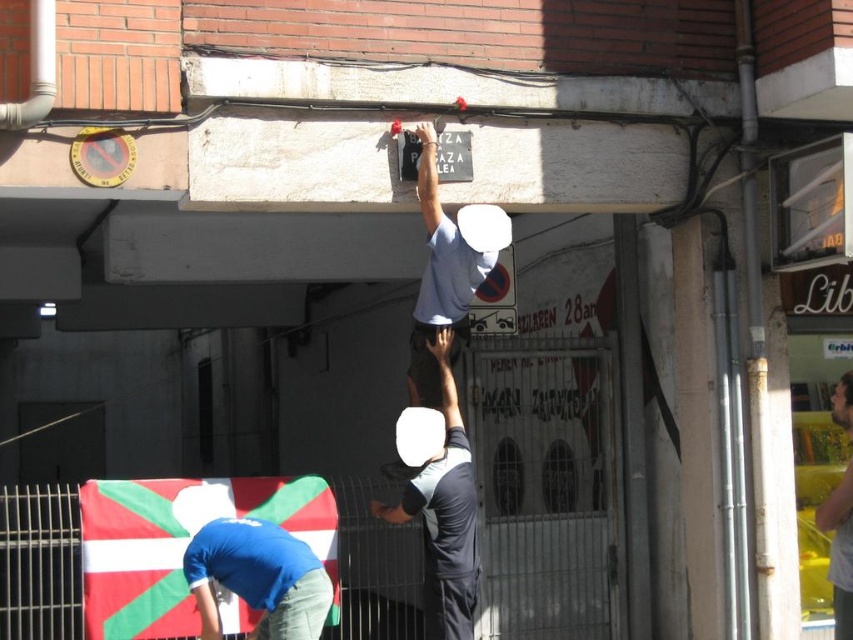
You are standing in the alleyway and want to hang a decoration between the two points, point [131,588] and point [376,509]. Which point is closer to you where you should start hanging the decoration?

Point [131,588] is closer to the viewer than point [376,509], so you should start hanging the decoration at point [131,588] first since it is nearer to you.

You are a drone operator trying to capture a photo of the green and white fabric flag at lower left. The drone is currently at the center of the image. Which direction should you move the drone to get closer to the flag?

The green and white fabric flag at lower left is located at point 0.850 on the x axis and 0.213 on the y axis. Since the drone is at the center, which is at point 0.5 on both axes, you should move the drone to the right and downward to reach the flag.

You are a photographer standing in the alleyway. You want to take a photo that includes both the green and white fabric flag at lower left and the light blue fabric shirt at upper center. Which object should you focus on first to ensure both are in focus?

You should focus on the green and white fabric flag at lower left first because it is closer to the viewer than the light blue fabric shirt at upper center. By focusing on the closer object, the farther one may still be within the depth of field, ensuring both are in focus.